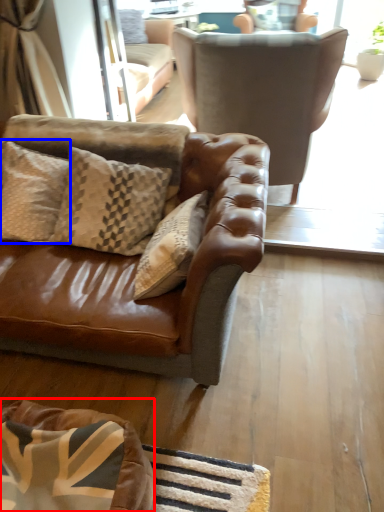
Question: Which object appears closest to the camera in this image, dog bed (highlighted by a red box) or pillow (highlighted by a blue box)?

Choices:
 (A) dog bed
 (B) pillow

Answer: (A)